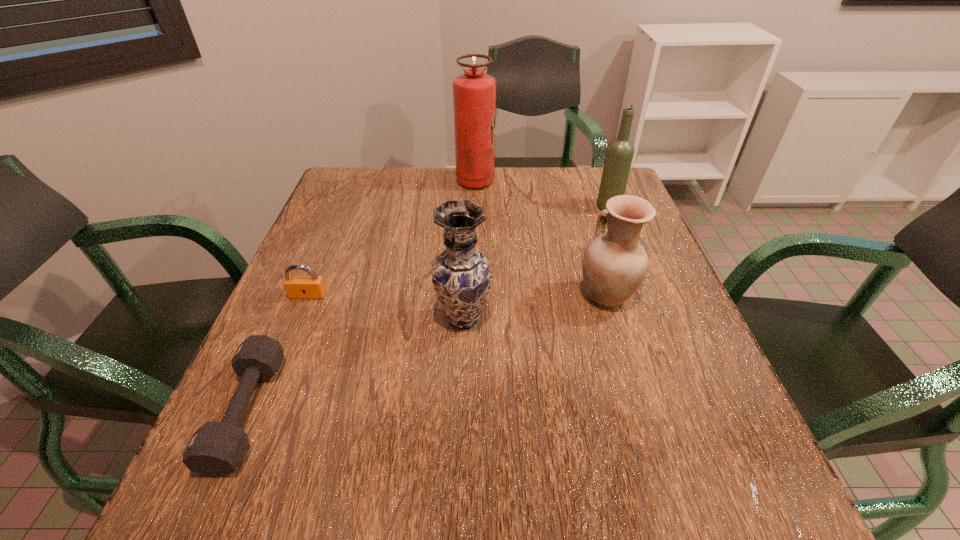
This screenshot has height=540, width=960. What are the coordinates of `free space between the pottery and the fire extinguisher` in the screenshot? It's located at (540, 238).

This screenshot has height=540, width=960. Find the location of `free spot between the fifth tallest object and the vase`. free spot between the fifth tallest object and the vase is located at coordinates (386, 307).

You are a GUI agent. You are given a task and a screenshot of the screen. Output one action in this format:
    pyautogui.click(x=<x>, y=<y>)
    Task: Click on the free space between the vase and the second shortest object
    The image size is (960, 540).
    Given the screenshot: What is the action you would take?
    pyautogui.click(x=386, y=307)

This screenshot has height=540, width=960. I want to click on object that can be found as the second closest to the vase, so [x=297, y=287].

Image resolution: width=960 pixels, height=540 pixels. In order to click on the fifth closest object to the farthest object in this screenshot , I will do `click(216, 449)`.

Image resolution: width=960 pixels, height=540 pixels. I want to click on free spot that satisfies the following two spatial constraints: 1. on the label side of the farthest object; 2. on the back side of the wine bottle, so click(475, 206).

Where is `blank area in the image that satisfies the following two spatial constraints: 1. on the label side of the fifth nearest object; 2. on the left side of the fire extinguisher`? blank area in the image that satisfies the following two spatial constraints: 1. on the label side of the fifth nearest object; 2. on the left side of the fire extinguisher is located at coordinates (x=475, y=206).

Where is `vacant area that satisfies the following two spatial constraints: 1. to unlock the padlock from the front; 2. on the right side of the pottery`? vacant area that satisfies the following two spatial constraints: 1. to unlock the padlock from the front; 2. on the right side of the pottery is located at coordinates (308, 295).

This screenshot has height=540, width=960. I want to click on vacant space that satisfies the following two spatial constraints: 1. on the back side of the vase; 2. on the right side of the fifth nearest object, so click(468, 206).

Locate an element on the screen. Image resolution: width=960 pixels, height=540 pixels. vacant space that satisfies the following two spatial constraints: 1. on the label side of the fire extinguisher; 2. to unlock the second shortest object from the front is located at coordinates (473, 295).